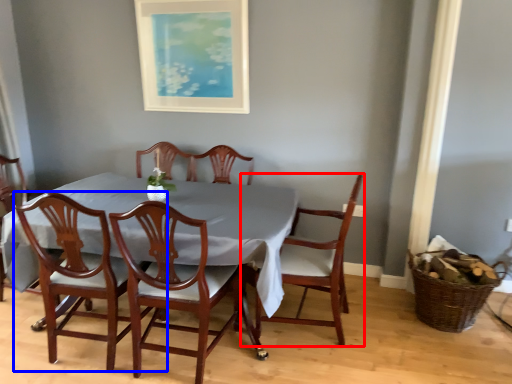
Question: Which object is closer to the camera taking this photo, chair (highlighted by a red box) or chair (highlighted by a blue box)?

Choices:
 (A) chair
 (B) chair

Answer: (B)